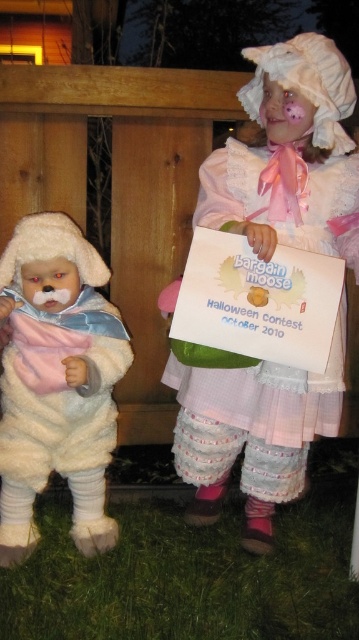
You are a photographer trying to capture both the white fluffy doll at upper center and the fluffy white teddy bear at left in a single shot. Based on their sizes, which object should you focus on first to ensure it fits properly in the frame?

The white fluffy doll at upper center is larger than the fluffy white teddy bear at left, so you should focus on the white fluffy doll at upper center first to ensure it fits properly in the frame.

In the scene shown: You are a photographer at the Bargain Moose Halloween Contest. You need to adjust your camera to focus on both the white fluffy doll at upper center and the fluffy white teddy bear at left. Which object should you focus on first to ensure both are in focus?

The white fluffy doll at upper center is above the fluffy white teddy bear at left, so you should focus on the teddy bear first to ensure both are in focus.

You are a photographer who needs to position a light at point (290,156) to illuminate the scene. Which object in the image is located exactly at that point?

The white fluffy doll at upper center is located exactly at point (290,156).